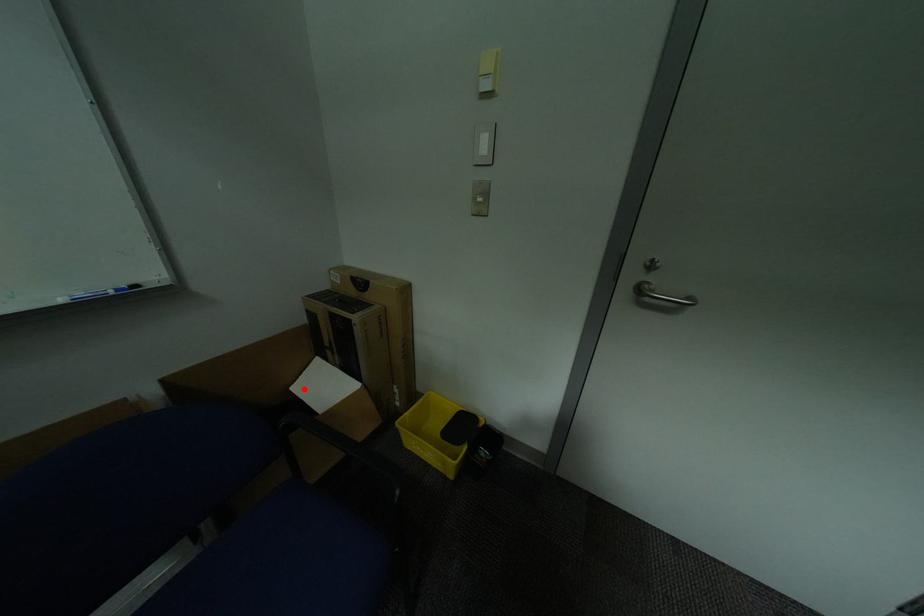
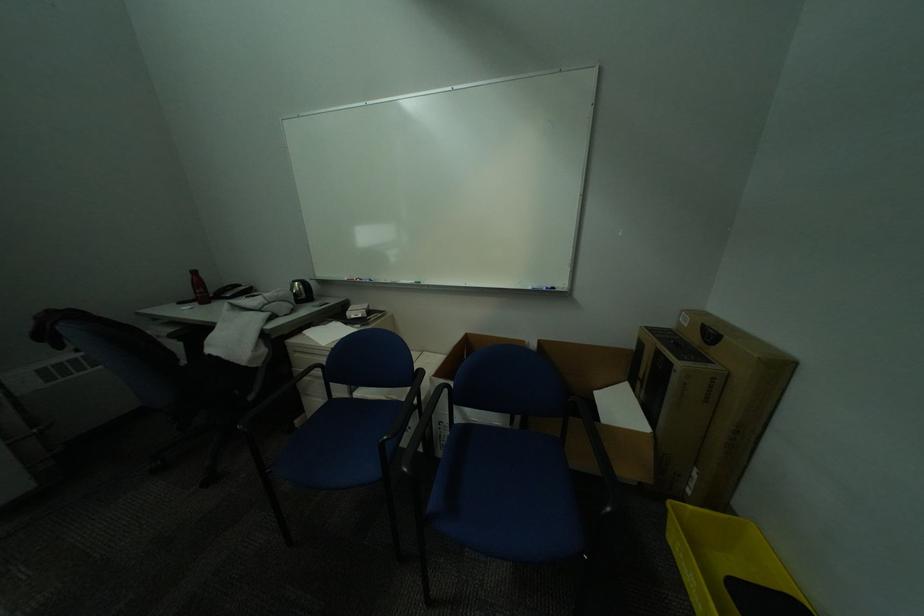
In the second image, find the point that corresponds to the highlighted location in the first image.

(606, 394)